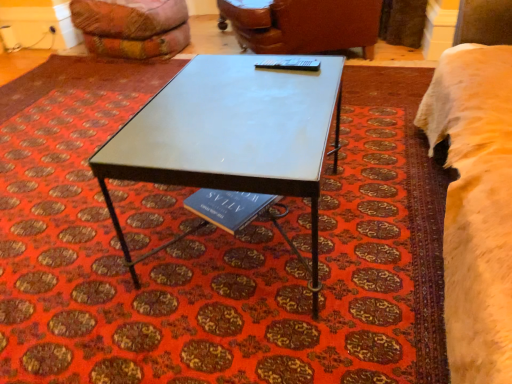
Describe the element at coordinates (216, 251) in the screenshot. I see `metallic gray table at center` at that location.

The image size is (512, 384). What do you see at coordinates (132, 27) in the screenshot?
I see `velvet orange bean bag at upper left` at bounding box center [132, 27].

Where is `metallic blue table tennis table at center`? metallic blue table tennis table at center is located at coordinates (290, 64).

What is the approximate height of metallic blue table tennis table at center?

1.42 inches.

This screenshot has width=512, height=384. What are the coordinates of `metallic gray table at center` in the screenshot? It's located at (216, 251).

Considering the sizes of objects velvet orange bean bag at upper left and fuzzy cream bed at right in the image provided, who is smaller, velvet orange bean bag at upper left or fuzzy cream bed at right?

Smaller between the two is velvet orange bean bag at upper left.

Is velvet orange bean bag at upper left not within fuzzy cream bed at right?

Yes, velvet orange bean bag at upper left is outside of fuzzy cream bed at right.

Is there a large distance between fuzzy cream bed at right and metallic gray table at center?

They are positioned close to each other.

From the image's perspective, does fuzzy cream bed at right appear higher than metallic gray table at center?

Actually, fuzzy cream bed at right appears below metallic gray table at center in the image.

In terms of width, does fuzzy cream bed at right look wider or thinner when compared to metallic gray table at center?

In the image, fuzzy cream bed at right appears to be more narrow than metallic gray table at center.

Is the surface of metallic gray table at center in direct contact with velvet orange bean bag at upper left?

There is a gap between metallic gray table at center and velvet orange bean bag at upper left.

How different are the orientations of metallic gray table at center and velvet orange bean bag at upper left in degrees?

They differ by 86 degrees in their facing directions.

Which is farther, [341,221] or [150,29]?

The point [150,29] is behind.

Does metallic gray table at center have a larger size compared to velvet orange bean bag at upper left?

Yes, metallic gray table at center is bigger than velvet orange bean bag at upper left.

Which object is further away from the camera, metallic blue table tennis table at center or metallic gray table at center?

metallic blue table tennis table at center.

From the image's perspective, is metallic blue table tennis table at center above or below metallic gray table at center?

Based on their image positions, metallic blue table tennis table at center is located above metallic gray table at center.

Looking at the image, does metallic blue table tennis table at center seem bigger or smaller compared to metallic gray table at center?

metallic blue table tennis table at center is smaller than metallic gray table at center.

Which is less distant, (499, 240) or (327, 41)?

The point (499, 240) is closer to the camera.

Are fuzzy cream bed at right and leather couch at upper center far apart?

fuzzy cream bed at right is far away from leather couch at upper center.

Locate an element on the screen. The height and width of the screenshot is (384, 512). bed that is below the leather couch at upper center (from the image's perspective) is located at coordinates (475, 206).

The width and height of the screenshot is (512, 384). What are the coordinates of `bean bag chair behind the leather couch at upper center` in the screenshot? It's located at (132, 27).

Considering the relative sizes of velvet orange bean bag at upper left and leather couch at upper center in the image provided, is velvet orange bean bag at upper left bigger than leather couch at upper center?

No.

From the image's perspective, which one is positioned lower, velvet orange bean bag at upper left or leather couch at upper center?

leather couch at upper center appears lower in the image.

Can leather couch at upper center be found inside metallic blue table tennis table at center?

No, leather couch at upper center is not inside metallic blue table tennis table at center.

Looking at the image, does metallic blue table tennis table at center seem bigger or smaller compared to leather couch at upper center?

Considering their sizes, metallic blue table tennis table at center takes up less space than leather couch at upper center.

Is point (273, 60) closer or farther from the camera than point (285, 51)?

Point (273, 60).

Is the surface of metallic blue table tennis table at center in direct contact with leather couch at upper center?

metallic blue table tennis table at center and leather couch at upper center are clearly separated.

Locate an element on the screen. bed above the velvet orange bean bag at upper left (from a real-world perspective) is located at coordinates (475, 206).

Image resolution: width=512 pixels, height=384 pixels. In order to click on mat located on the left of fuzzy cream bed at right in this screenshot , I will do `click(216, 251)`.

From the image, which object appears to be nearer to fuzzy cream bed at right, velvet orange bean bag at upper left or metallic gray table at center?

Based on the image, metallic gray table at center appears to be nearer to fuzzy cream bed at right.

Based on the photo, when comparing their distances from velvet orange bean bag at upper left, does leather couch at upper center or fuzzy cream bed at right seem further?

fuzzy cream bed at right lies further to velvet orange bean bag at upper left than the other object.

Considering their positions, is leather couch at upper center positioned closer to metallic gray table at center than fuzzy cream bed at right?

Based on the image, fuzzy cream bed at right appears to be nearer to metallic gray table at center.

Considering their positions, is metallic blue table tennis table at center positioned further to metallic gray table at center than fuzzy cream bed at right?

Based on the image, metallic blue table tennis table at center appears to be further to metallic gray table at center.

Looking at this image, considering their positions, is leather couch at upper center positioned closer to velvet orange bean bag at upper left than metallic gray table at center?

Based on the image, leather couch at upper center appears to be nearer to velvet orange bean bag at upper left.

From the image, which object appears to be nearer to metallic blue table tennis table at center, metallic gray table at center or fuzzy cream bed at right?

fuzzy cream bed at right is closer to metallic blue table tennis table at center.

Which object lies further to the anchor point metallic gray table at center, metallic blue table tennis table at center or leather couch at upper center?

Based on the image, leather couch at upper center appears to be further to metallic gray table at center.

Estimate the real-world distances between objects in this image. Which object is closer to metallic blue table tennis table at center, leather couch at upper center or fuzzy cream bed at right?

fuzzy cream bed at right is positioned closer to the anchor metallic blue table tennis table at center.

This screenshot has width=512, height=384. Find the location of `coffee table located between metallic gray table at center and fuzzy cream bed at right in the left-right direction`. coffee table located between metallic gray table at center and fuzzy cream bed at right in the left-right direction is located at coordinates (231, 135).

In order to click on table tennis table located between metallic gray table at center and velvet orange bean bag at upper left in the depth direction in this screenshot , I will do `click(290, 64)`.

Find the location of a particular element. mat between fuzzy cream bed at right and leather couch at upper center along the z-axis is located at coordinates [216, 251].

Where is `table tennis table between velvet orange bean bag at upper left and leather couch at upper center in the horizontal direction`? table tennis table between velvet orange bean bag at upper left and leather couch at upper center in the horizontal direction is located at coordinates (290, 64).